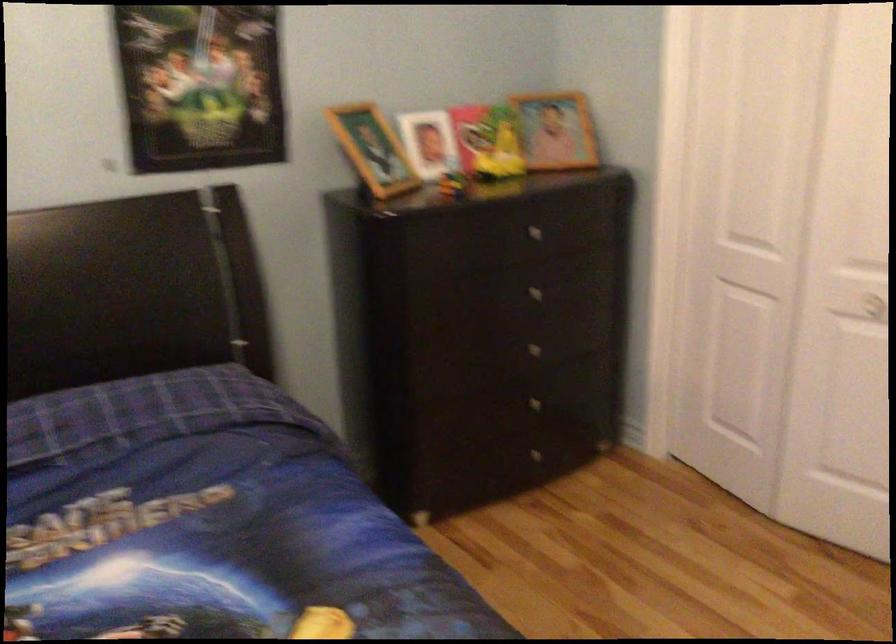
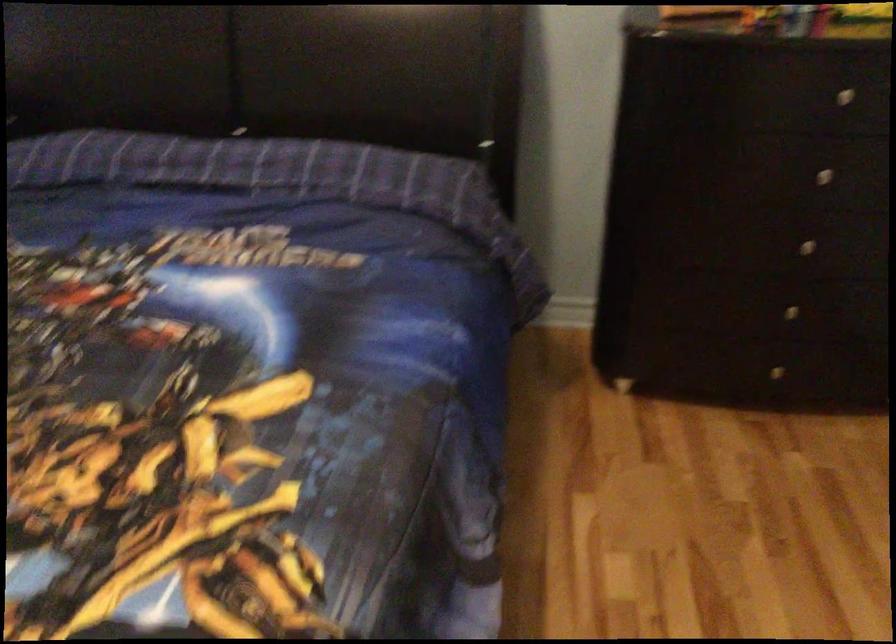
Where in the second image is the point corresponding to (x=541, y=401) from the first image?

(790, 310)